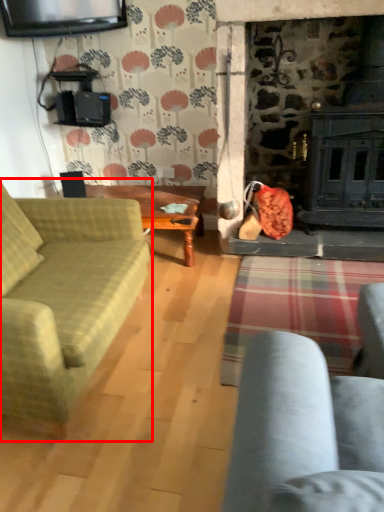
Question: From the image's perspective, what is the correct spatial relationship of studio couch (annotated by the red box) in relation to table?

Choices:
 (A) below
 (B) above

Answer: (A)